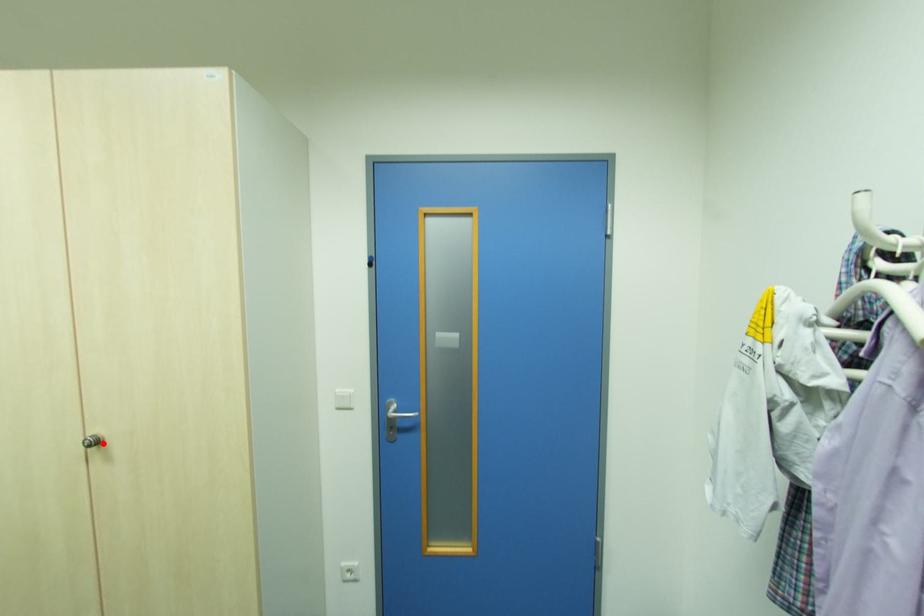
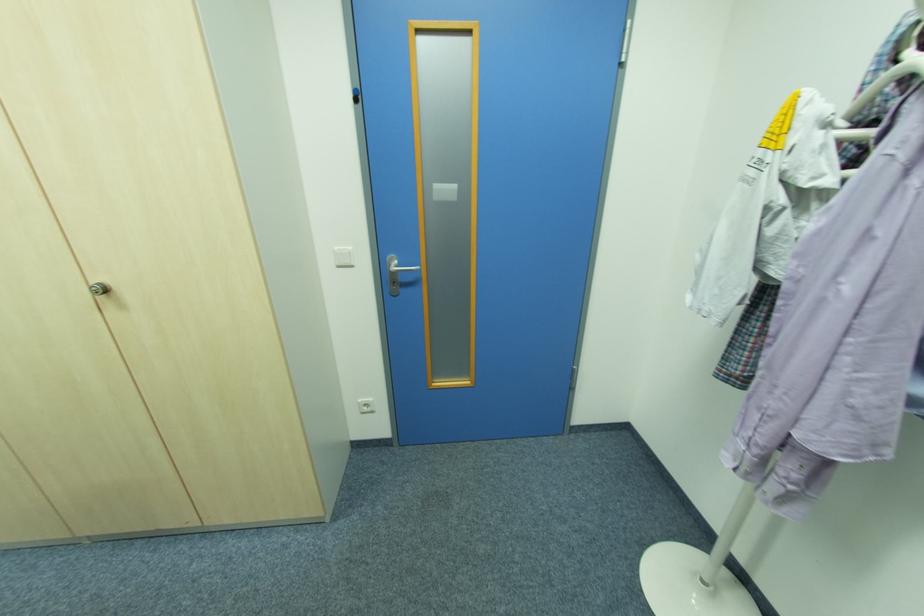
Where in the second image is the point corresponding to the highlighted location from the first image?

(108, 292)